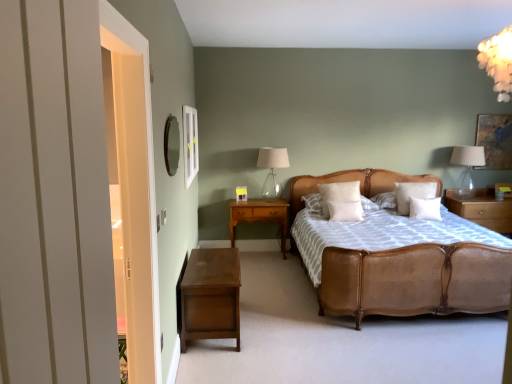
Question: Is point (340, 218) closer or farther from the camera than point (179, 130)?

Choices:
 (A) closer
 (B) farther

Answer: (B)

Question: In the image, is white soft pillow at center, the fourth pillow viewed from the right, on the left side or the right side of wooden mirror at upper left?

Choices:
 (A) left
 (B) right

Answer: (B)

Question: Estimate the real-world distances between objects in this image. Which object is closer to the woven rattan bed at center?

Choices:
 (A) clear glass table lamp at upper right, the 1th table lamp from the right
 (B) dark brown wood nightstand at lower left, the third nightstand in the back-to-front sequence
 (C) white glossy frame at upper left
 (D) wooden nightstand at right, acting as the third nightstand starting from the left
 (E) white wood door at left

Answer: (B)

Question: Which object is the closest to the wooden mirror at upper left?

Choices:
 (A) white wood door at left
 (B) clear glass table lamp at center, arranged as the 2th table lamp when viewed from the right
 (C) white soft pillow at center, marked as the 3th pillow in a right-to-left arrangement
 (D) clear glass table lamp at upper right, the 1th table lamp from the right
 (E) white glossy frame at upper left

Answer: (A)